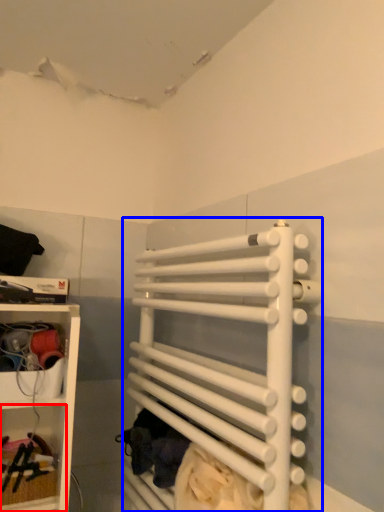
Question: Which object is closer to the camera taking this photo, cabinet (highlighted by a red box) or bunk bed (highlighted by a blue box)?

Choices:
 (A) cabinet
 (B) bunk bed

Answer: (B)